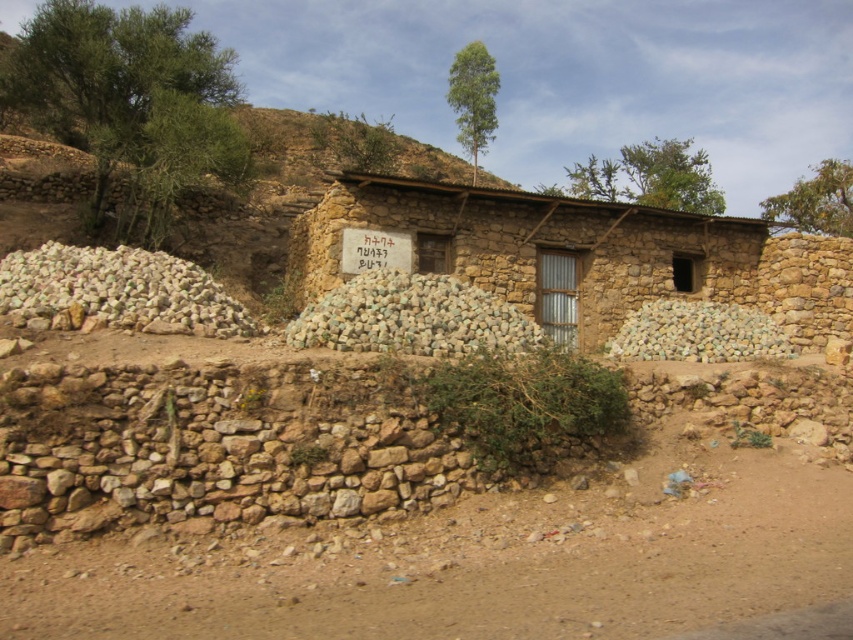
Question: Among these points, which one is farthest from the camera?

Choices:
 (A) (692, 330)
 (B) (172, 268)
 (C) (344, 339)
 (D) (444, 259)

Answer: (A)

Question: Does white smooth stones at left come in front of white smooth stones at center?

Choices:
 (A) no
 (B) yes

Answer: (B)

Question: Which point is closer to the camera taking this photo?

Choices:
 (A) (318, 204)
 (B) (48, 307)
 (C) (688, 337)
 (D) (387, 284)

Answer: (B)

Question: Which object appears closest to the camera in this image?

Choices:
 (A) blue textured stones at center
 (B) brown mud hut at center
 (C) white smooth stones at center
 (D) white smooth stones at left

Answer: (D)

Question: Where is blue textured stones at center located in relation to white smooth stones at center in the image?

Choices:
 (A) below
 (B) above

Answer: (B)

Question: Can you confirm if white smooth stones at left is wider than white smooth stones at center?

Choices:
 (A) yes
 (B) no

Answer: (A)